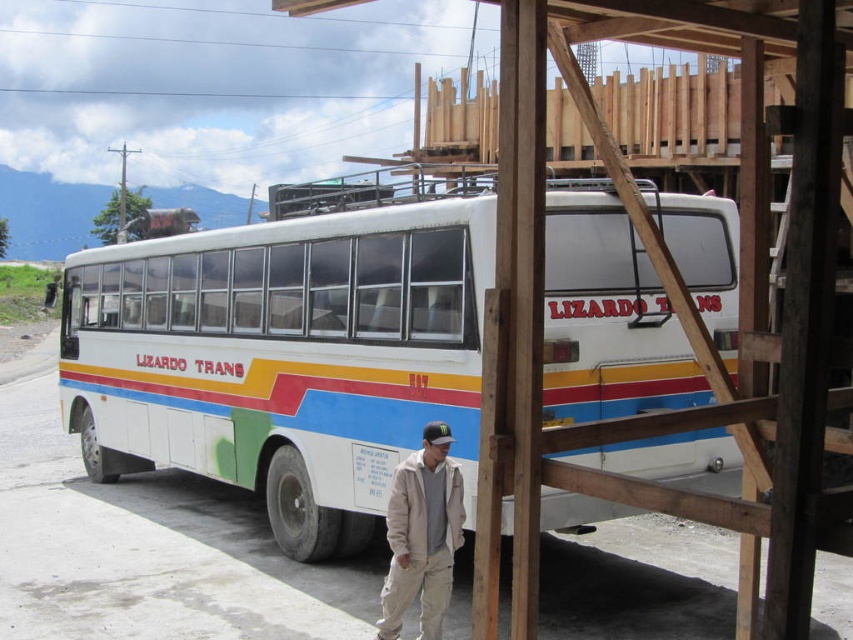
Question: Is white matte bus at center to the left of khaki cotton pants at lower center from the viewer's perspective?

Choices:
 (A) no
 (B) yes

Answer: (A)

Question: Which of the following is the closest to the observer?

Choices:
 (A) (447, 506)
 (B) (419, 202)

Answer: (A)

Question: Can you confirm if white matte bus at center is positioned below khaki cotton pants at lower center?

Choices:
 (A) no
 (B) yes

Answer: (A)

Question: Observing the image, what is the correct spatial positioning of white matte bus at center in reference to khaki cotton pants at lower center?

Choices:
 (A) left
 (B) right

Answer: (B)